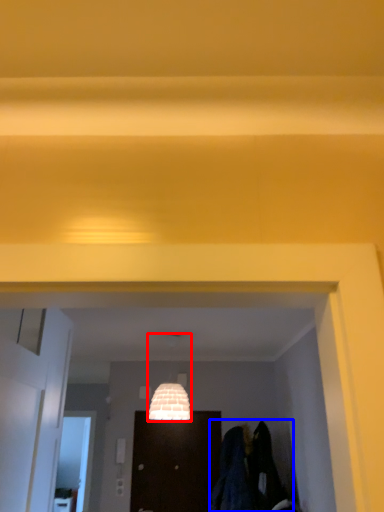
Question: Which object appears closest to the camera in this image, lamp (highlighted by a red box) or laundry (highlighted by a blue box)?

Choices:
 (A) lamp
 (B) laundry

Answer: (A)